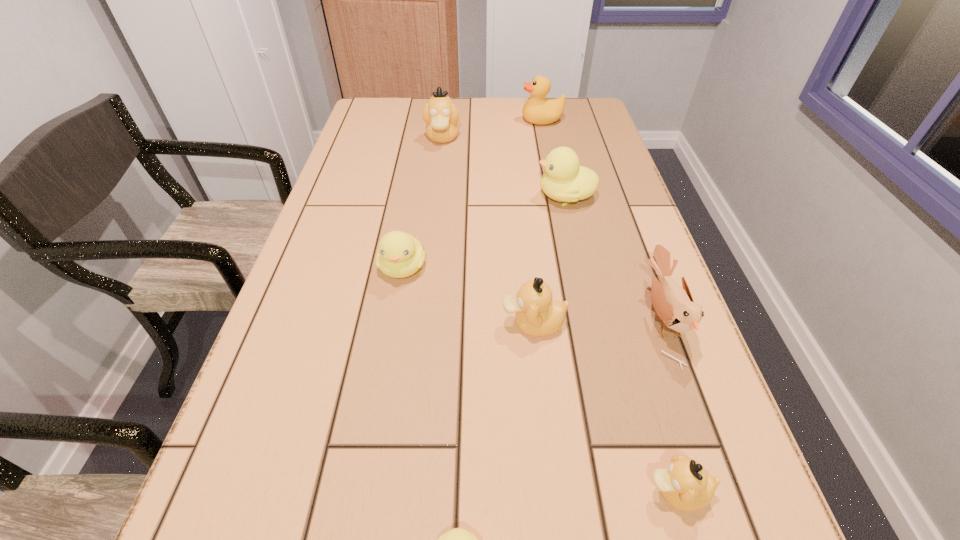
Where is `vacant space located 0.210m on the face of the second nearest tan duckling`? vacant space located 0.210m on the face of the second nearest tan duckling is located at coordinates (390, 323).

The image size is (960, 540). What are the coordinates of `vacant space situated 0.340m on the face of the second nearest tan duckling` in the screenshot? It's located at (320, 323).

Identify the location of free region located at the beak of the bird. The width and height of the screenshot is (960, 540). (465, 319).

Where is `vacant space located 0.090m at the beak of the bird`? vacant space located 0.090m at the beak of the bird is located at coordinates (597, 319).

This screenshot has height=540, width=960. Identify the location of blank space located at the beak of the bird. (608, 319).

At what (x,y) coordinates should I click in order to perform the action: click on vacant area located 0.100m at the beak of the second nearest yellow duckling. Please return your answer as a coordinate pair (x, y). The image size is (960, 540). Looking at the image, I should click on (392, 328).

At what (x,y) coordinates should I click in order to perform the action: click on vacant space situated 0.300m on the face of the second nearest duckling. Please return your answer as a coordinate pair (x, y). Image resolution: width=960 pixels, height=540 pixels. Looking at the image, I should click on (432, 492).

Where is `free region located on the face of the second nearest duckling`? This screenshot has height=540, width=960. free region located on the face of the second nearest duckling is located at coordinates (539, 492).

The width and height of the screenshot is (960, 540). I want to click on free space located on the face of the second nearest duckling, so [x=560, y=492].

Where is `duckling positioned at the far edge`? duckling positioned at the far edge is located at coordinates (441, 116).